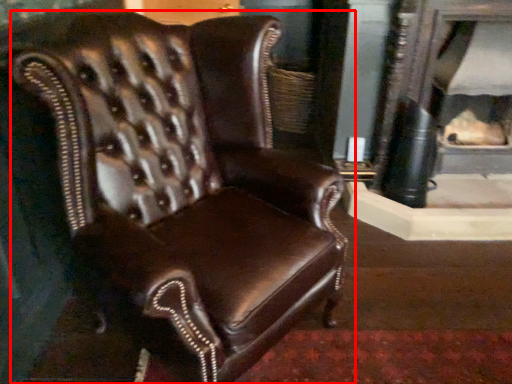
Question: In this image, where is chair (annotated by the red box) located relative to fireplace?

Choices:
 (A) left
 (B) right

Answer: (A)